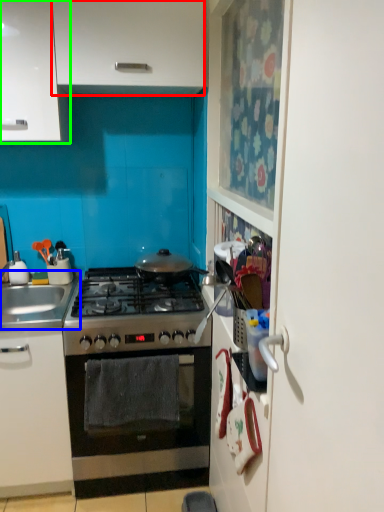
Question: Which is nearer to the cabinetry (highlighted by a red box)? sink (highlighted by a blue box) or cabinetry (highlighted by a green box).

Choices:
 (A) sink
 (B) cabinetry

Answer: (B)